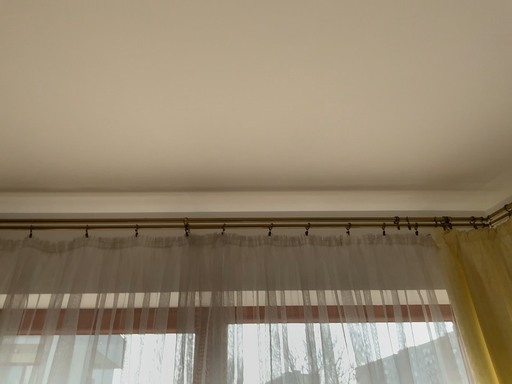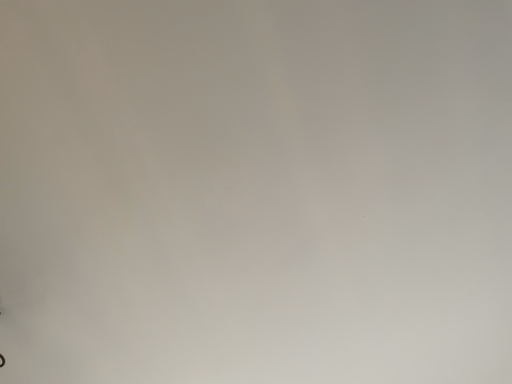
Question: Which way did the camera rotate in the video?

Choices:
 (A) rotated left
 (B) rotated right

Answer: (A)